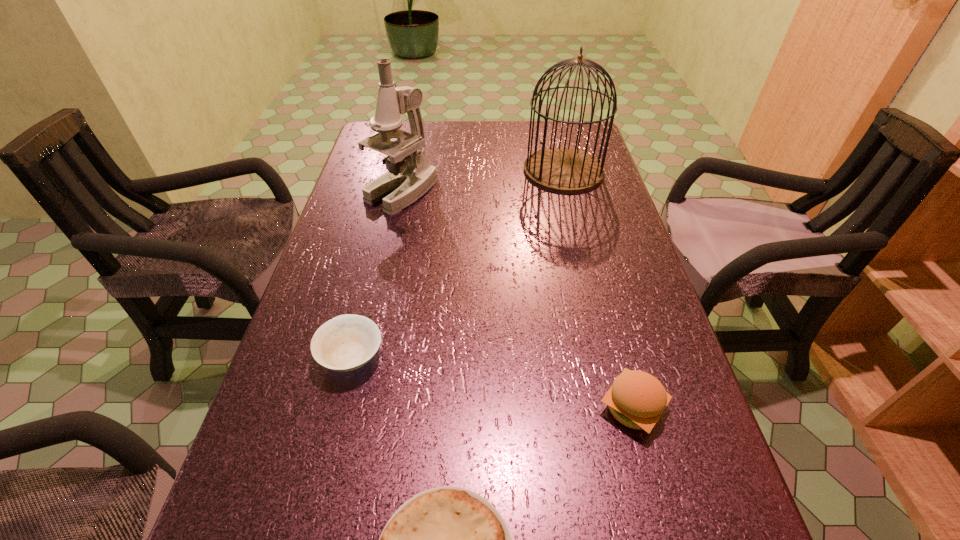
What are the coordinates of `empty space that is in between the third shortest object and the microscope` in the screenshot? It's located at (517, 300).

Where is `free space between the hamburger and the microscope`? The width and height of the screenshot is (960, 540). free space between the hamburger and the microscope is located at coordinates (517, 300).

You are a GUI agent. You are given a task and a screenshot of the screen. Output one action in this format:
    pyautogui.click(x=<x>, y=<y>)
    Task: Click on the empty space between the third tallest object and the microscope
    
    Given the screenshot: What is the action you would take?
    pyautogui.click(x=517, y=300)

Image resolution: width=960 pixels, height=540 pixels. Find the location of `vacant point located between the third shortest object and the birdcage`. vacant point located between the third shortest object and the birdcage is located at coordinates (598, 289).

The height and width of the screenshot is (540, 960). Find the location of `blank region between the third shortest object and the birdcage`. blank region between the third shortest object and the birdcage is located at coordinates (598, 289).

Image resolution: width=960 pixels, height=540 pixels. Find the location of `object that can be found as the third closest to the third tallest object`. object that can be found as the third closest to the third tallest object is located at coordinates (410, 175).

Identify which object is the nearest to the microscope. Please provide its 2D coordinates. Your answer should be formatted as a tuple, i.e. [(x, y)], where the tuple contains the x and y coordinates of a point satisfying the conditions above.

[(565, 170)]